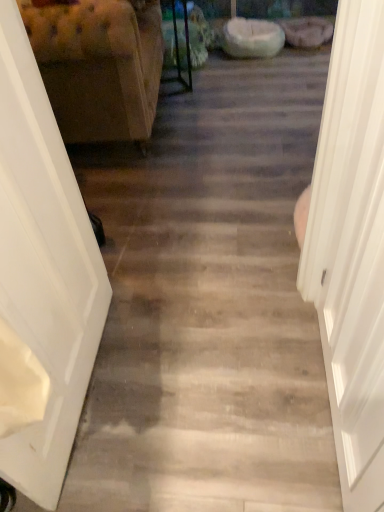
Question: Considering the relative sizes of white smooth door at right, placed as the 2th door when sorted from left to right, and white glossy door at left, the 1th door viewed from the left, in the image provided, is white smooth door at right, placed as the 2th door when sorted from left to right, bigger than white glossy door at left, the 1th door viewed from the left,?

Choices:
 (A) yes
 (B) no

Answer: (A)

Question: Is white smooth door at right, the 1th door viewed from the right, looking in the opposite direction of white glossy door at left, the 1th door viewed from the left?

Choices:
 (A) no
 (B) yes

Answer: (B)

Question: Is the surface of white smooth door at right, the 1th door viewed from the right, in direct contact with white glossy door at left, positioned as the second door in right-to-left order?

Choices:
 (A) no
 (B) yes

Answer: (A)

Question: Is white smooth door at right, placed as the 2th door when sorted from left to right, thinner than white glossy door at left, the 1th door viewed from the left?

Choices:
 (A) no
 (B) yes

Answer: (A)

Question: Can you confirm if white smooth door at right, placed as the 2th door when sorted from left to right, is taller than white glossy door at left, the 1th door viewed from the left?

Choices:
 (A) yes
 (B) no

Answer: (A)

Question: Considering the positions of point (382, 493) and point (82, 73), is point (382, 493) closer or farther from the camera than point (82, 73)?

Choices:
 (A) farther
 (B) closer

Answer: (B)

Question: In the image, is white smooth door at right, the 1th door viewed from the right, positioned in front of or behind tufted fabric armchair at left?

Choices:
 (A) behind
 (B) front

Answer: (B)

Question: Is white smooth door at right, placed as the 2th door when sorted from left to right, taller or shorter than tufted fabric armchair at left?

Choices:
 (A) tall
 (B) short

Answer: (A)

Question: From a real-world perspective, is white smooth door at right, placed as the 2th door when sorted from left to right, positioned above or below tufted fabric armchair at left?

Choices:
 (A) below
 (B) above

Answer: (B)

Question: Considering the positions of white glossy door at left, the 1th door viewed from the left, and white smooth door at right, placed as the 2th door when sorted from left to right, in the image, is white glossy door at left, the 1th door viewed from the left, taller or shorter than white smooth door at right, placed as the 2th door when sorted from left to right,?

Choices:
 (A) tall
 (B) short

Answer: (B)

Question: In the image, is white glossy door at left, positioned as the second door in right-to-left order, on the left side or the right side of white smooth door at right, the 1th door viewed from the right?

Choices:
 (A) left
 (B) right

Answer: (A)

Question: In terms of width, does white glossy door at left, the 1th door viewed from the left, look wider or thinner when compared to white smooth door at right, placed as the 2th door when sorted from left to right?

Choices:
 (A) wide
 (B) thin

Answer: (B)

Question: Considering their positions, is white glossy door at left, the 1th door viewed from the left, located in front of or behind white smooth door at right, placed as the 2th door when sorted from left to right?

Choices:
 (A) front
 (B) behind

Answer: (B)

Question: From the image's perspective, is white glossy door at left, the 1th door viewed from the left, positioned above or below tufted fabric armchair at left?

Choices:
 (A) below
 (B) above

Answer: (A)

Question: From a real-world perspective, relative to tufted fabric armchair at left, is white glossy door at left, the 1th door viewed from the left, vertically above or below?

Choices:
 (A) above
 (B) below

Answer: (A)